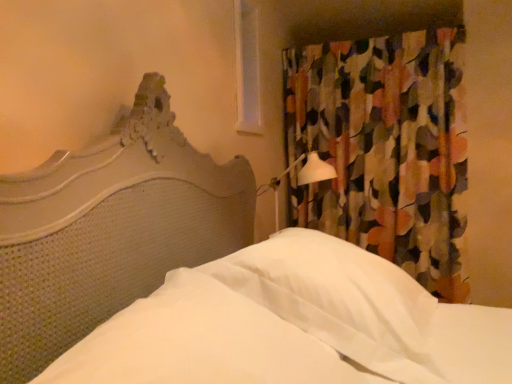
Question: Could you tell me if multicolored fabric curtain at upper right is turned towards white plastic window at upper center?

Choices:
 (A) no
 (B) yes

Answer: (B)

Question: Is multicolored fabric curtain at upper right behind white plastic window at upper center?

Choices:
 (A) no
 (B) yes

Answer: (B)

Question: Is multicolored fabric curtain at upper right touching white plastic window at upper center?

Choices:
 (A) yes
 (B) no

Answer: (B)

Question: Is multicolored fabric curtain at upper right at the left side of white plastic window at upper center?

Choices:
 (A) yes
 (B) no

Answer: (B)

Question: Can you confirm if multicolored fabric curtain at upper right is positioned to the right of white plastic window at upper center?

Choices:
 (A) no
 (B) yes

Answer: (B)

Question: Is point [258, 39] positioned closer to the camera than point [380, 172]?

Choices:
 (A) farther
 (B) closer

Answer: (B)

Question: Is white plastic window at upper center in front of or behind multicolored fabric curtain at upper right in the image?

Choices:
 (A) behind
 (B) front

Answer: (B)

Question: Based on their sizes in the image, would you say white plastic window at upper center is bigger or smaller than multicolored fabric curtain at upper right?

Choices:
 (A) small
 (B) big

Answer: (A)

Question: Which is correct: white plastic window at upper center is inside multicolored fabric curtain at upper right, or outside of it?

Choices:
 (A) inside
 (B) outside

Answer: (B)

Question: Which is correct: white soft pillow at center is inside white fabric sheet at center, or outside of it?

Choices:
 (A) inside
 (B) outside

Answer: (B)

Question: From the image's perspective, is white soft pillow at center located above or below white fabric sheet at center?

Choices:
 (A) below
 (B) above

Answer: (B)

Question: Considering the positions of white soft pillow at center and white fabric sheet at center in the image, is white soft pillow at center bigger or smaller than white fabric sheet at center?

Choices:
 (A) small
 (B) big

Answer: (B)

Question: In the image, is white soft pillow at center on the left side or the right side of white fabric sheet at center?

Choices:
 (A) right
 (B) left

Answer: (A)

Question: Considering the positions of multicolored fabric curtain at upper right and white fabric sheet at center in the image, is multicolored fabric curtain at upper right taller or shorter than white fabric sheet at center?

Choices:
 (A) short
 (B) tall

Answer: (B)

Question: In the image, is multicolored fabric curtain at upper right on the left side or the right side of white fabric sheet at center?

Choices:
 (A) right
 (B) left

Answer: (A)